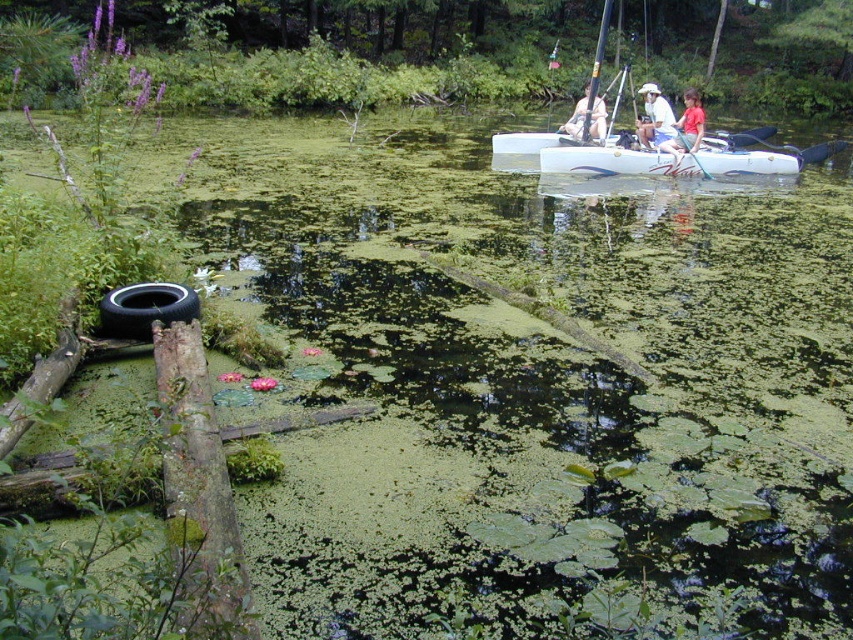
Question: Is white glossy kayak at upper center wider than wooden paddle at center?

Choices:
 (A) no
 (B) yes

Answer: (B)

Question: Which object is closer to the camera taking this photo?

Choices:
 (A) white glossy kayak at upper center
 (B) black rubber tire at lower left
 (C) red cotton shirt at upper right
 (D) white fabric hat at upper center

Answer: (B)

Question: Which point is closer to the camera?

Choices:
 (A) white glossy kayak at upper center
 (B) white fabric hat at upper center

Answer: (A)

Question: Can you confirm if white fabric hat at upper center is bigger than red cotton shirt at upper right?

Choices:
 (A) yes
 (B) no

Answer: (B)

Question: Does black rubber tire at lower left appear on the left side of matte white kayak at upper center?

Choices:
 (A) yes
 (B) no

Answer: (A)

Question: Which of the following is the closest to the observer?

Choices:
 (A) white glossy kayak at upper center
 (B) wooden paddle at center
 (C) black rubber tire at lower left
 (D) matte white kayak at upper center

Answer: (C)